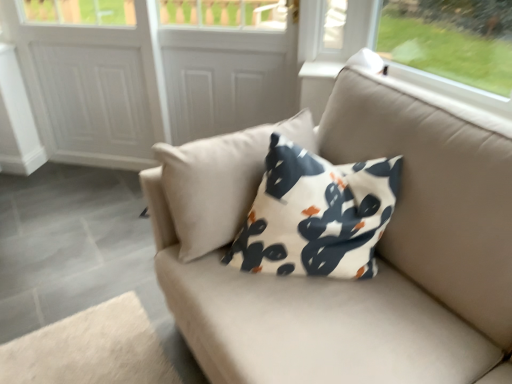
Question: From the image's perspective, would you say white matte screen door at upper center, which is the second screen door from right to left, is positioned over white matte door at center, acting as the first screen door starting from the right?

Choices:
 (A) no
 (B) yes

Answer: (A)

Question: Is white matte screen door at upper center, positioned as the second screen door in left-to-right order, to the right of white matte door at center, the 3th screen door when ordered from left to right, from the viewer's perspective?

Choices:
 (A) no
 (B) yes

Answer: (A)

Question: From the image's perspective, is white matte screen door at upper center, which is the second screen door from right to left, beneath white matte door at center, acting as the first screen door starting from the right?

Choices:
 (A) no
 (B) yes

Answer: (B)

Question: From a real-world perspective, is white matte screen door at upper center, positioned as the second screen door in left-to-right order, physically below white matte door at center, acting as the first screen door starting from the right?

Choices:
 (A) no
 (B) yes

Answer: (B)

Question: Are white matte screen door at upper center, which is the second screen door from right to left, and white matte door at center, the 3th screen door when ordered from left to right, located far from each other?

Choices:
 (A) no
 (B) yes

Answer: (A)

Question: Visually, is white textured screen door at upper center, which ranks as the third screen door in right-to-left order, positioned to the left or to the right of white matte door at center, the 3th screen door when ordered from left to right?

Choices:
 (A) right
 (B) left

Answer: (B)

Question: Is white textured screen door at upper center, marked as the 1th screen door in a left-to-right arrangement, in front of or behind white matte door at center, the 3th screen door when ordered from left to right, in the image?

Choices:
 (A) behind
 (B) front

Answer: (A)

Question: Is white textured screen door at upper center, marked as the 1th screen door in a left-to-right arrangement, wider or thinner than white matte door at center, acting as the first screen door starting from the right?

Choices:
 (A) thin
 (B) wide

Answer: (A)

Question: From the image's perspective, is white textured screen door at upper center, which ranks as the third screen door in right-to-left order, positioned above or below white matte door at center, acting as the first screen door starting from the right?

Choices:
 (A) below
 (B) above

Answer: (B)

Question: Is white matte door at center, acting as the first screen door starting from the right, to the left or to the right of white textured screen door at upper center, marked as the 1th screen door in a left-to-right arrangement, in the image?

Choices:
 (A) right
 (B) left

Answer: (A)

Question: Do you think white matte door at center, acting as the first screen door starting from the right, is within white textured screen door at upper center, which ranks as the third screen door in right-to-left order, or outside of it?

Choices:
 (A) outside
 (B) inside

Answer: (A)

Question: Looking at their shapes, would you say white matte door at center, acting as the first screen door starting from the right, is wider or thinner than white textured screen door at upper center, marked as the 1th screen door in a left-to-right arrangement?

Choices:
 (A) wide
 (B) thin

Answer: (A)

Question: Is white matte door at center, the 3th screen door when ordered from left to right, in front of or behind white textured screen door at upper center, marked as the 1th screen door in a left-to-right arrangement, in the image?

Choices:
 (A) behind
 (B) front

Answer: (B)

Question: Is point (218, 43) positioned closer to the camera than point (121, 89)?

Choices:
 (A) closer
 (B) farther

Answer: (A)

Question: Considering the positions of white matte screen door at upper center, which is the second screen door from right to left, and white textured screen door at upper center, marked as the 1th screen door in a left-to-right arrangement, in the image, is white matte screen door at upper center, which is the second screen door from right to left, wider or thinner than white textured screen door at upper center, marked as the 1th screen door in a left-to-right arrangement,?

Choices:
 (A) wide
 (B) thin

Answer: (B)